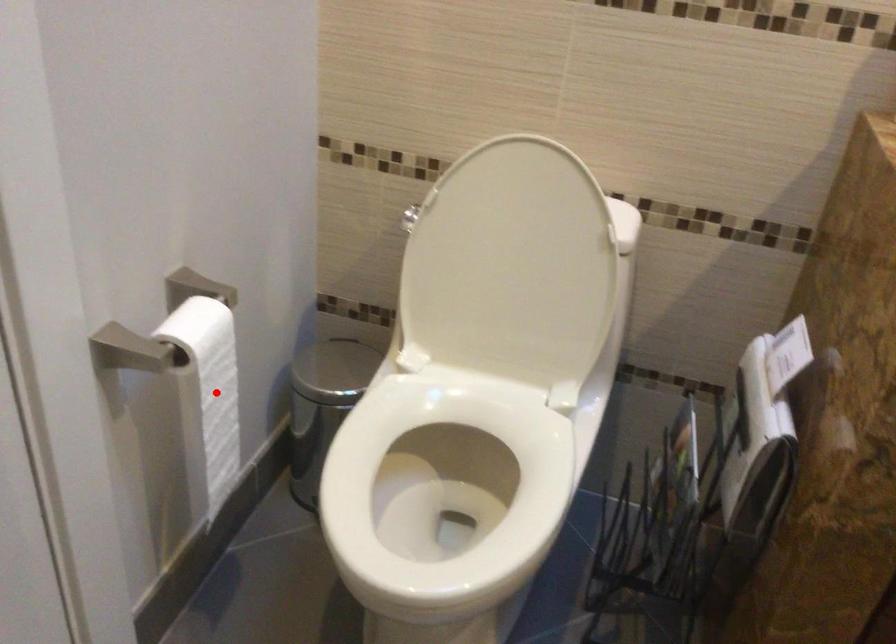
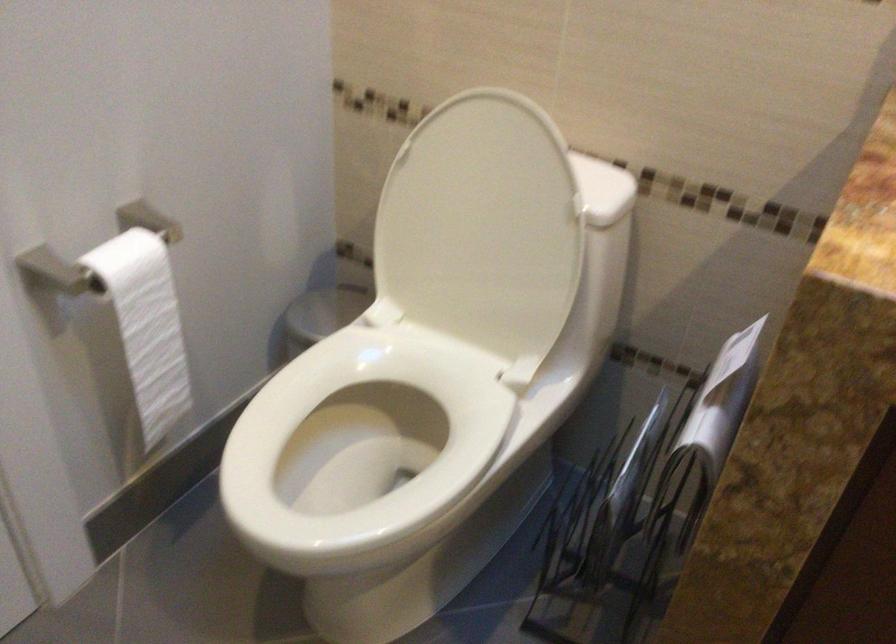
Find the pixel in the second image that matches the highlighted location in the first image.

(147, 325)